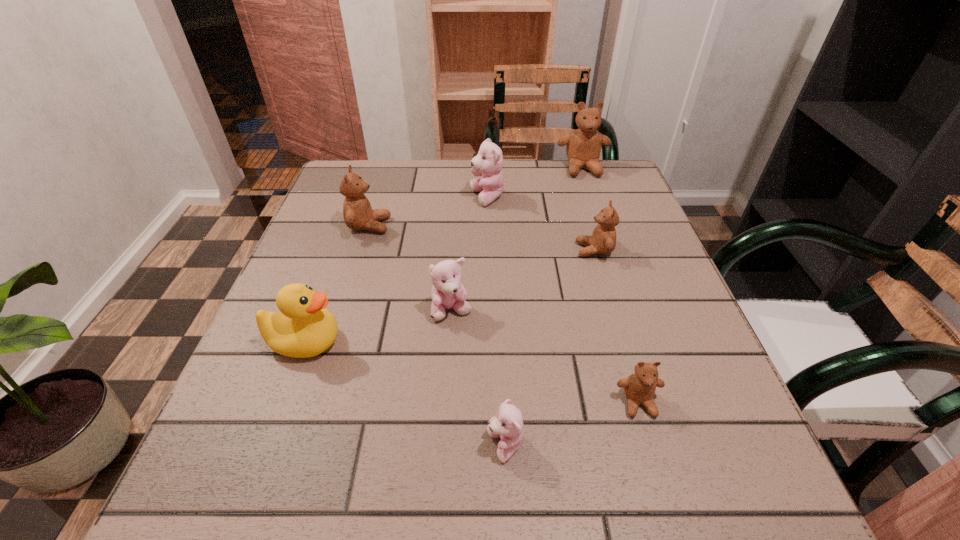
Point out which brown teddy bear is positioned as the fourth nearest to the nearest teddy bear. Please provide its 2D coordinates. Your answer should be formatted as a tuple, i.e. [(x, y)], where the tuple contains the x and y coordinates of a point satisfying the conditions above.

[(583, 148)]

Where is `the second closest brown teddy bear relative to the nearest object`? the second closest brown teddy bear relative to the nearest object is located at coordinates (603, 240).

Where is `pink teddy bear identified as the closest to the fifth farthest teddy bear`? This screenshot has height=540, width=960. pink teddy bear identified as the closest to the fifth farthest teddy bear is located at coordinates (508, 423).

The width and height of the screenshot is (960, 540). In order to click on the second closest pink teddy bear to the nearest teddy bear in this screenshot , I will do click(488, 163).

You are a GUI agent. You are given a task and a screenshot of the screen. Output one action in this format:
    pyautogui.click(x=<x>, y=<y>)
    Task: Click on the free space that satisfies the following two spatial constraints: 1. on the face of the tallest object; 2. at the face of the smallest pink teddy bear
    This screenshot has height=540, width=960.
    Given the screenshot: What is the action you would take?
    (x=676, y=446)